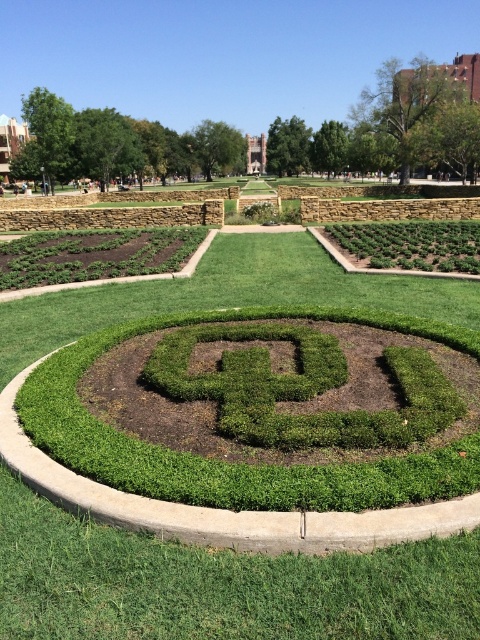
Question: Is green shrubbery at lower left bigger than green leafy hedge at right?

Choices:
 (A) no
 (B) yes

Answer: (B)

Question: Among these objects, which one is farthest from the camera?

Choices:
 (A) green shrubbery at lower left
 (B) green grass at center

Answer: (A)

Question: Which point is closer to the camera?

Choices:
 (A) green leafy hedge at right
 (B) green grass at center
 (C) green shrubbery at lower left

Answer: (B)

Question: Among these objects, which one is farthest from the camera?

Choices:
 (A) green leafy hedge at right
 (B) green grass at center
 (C) green shrubbery at lower left

Answer: (A)

Question: Does green grass at center appear over green leafy hedge at right?

Choices:
 (A) yes
 (B) no

Answer: (B)

Question: Observing the image, what is the correct spatial positioning of green shrubbery at lower left in reference to green leafy hedge at right?

Choices:
 (A) below
 (B) above

Answer: (A)